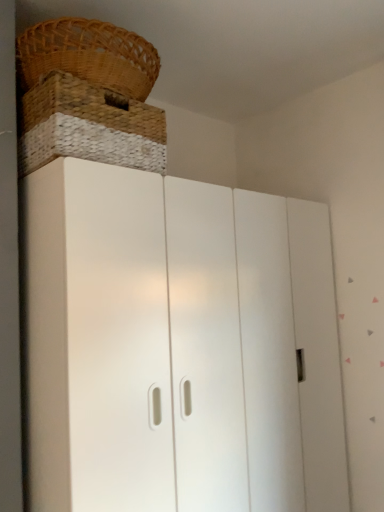
Question: Does white matte cupboard at center come in front of brown woven basket at upper left?

Choices:
 (A) no
 (B) yes

Answer: (B)

Question: Considering the relative sizes of white matte cupboard at center and brown woven basket at upper left in the image provided, is white matte cupboard at center bigger than brown woven basket at upper left?

Choices:
 (A) no
 (B) yes

Answer: (B)

Question: Are white matte cupboard at center and brown woven basket at upper left beside each other?

Choices:
 (A) no
 (B) yes

Answer: (A)

Question: Does white matte cupboard at center have a smaller size compared to brown woven basket at upper left?

Choices:
 (A) yes
 (B) no

Answer: (B)

Question: Is white matte cupboard at center positioned with its back to brown woven basket at upper left?

Choices:
 (A) no
 (B) yes

Answer: (A)

Question: Are white matte cupboard at center and brown woven basket at upper left located far from each other?

Choices:
 (A) no
 (B) yes

Answer: (A)

Question: Can you confirm if brown woven basket at upper left is thinner than white matte cupboard at center?

Choices:
 (A) yes
 (B) no

Answer: (A)

Question: Is brown woven basket at upper left oriented towards white matte cupboard at center?

Choices:
 (A) yes
 (B) no

Answer: (B)

Question: Considering the relative positions of brown woven basket at upper left and white matte cupboard at center in the image provided, is brown woven basket at upper left to the left of white matte cupboard at center from the viewer's perspective?

Choices:
 (A) yes
 (B) no

Answer: (A)

Question: Does brown woven basket at upper left have a greater width compared to white matte cupboard at center?

Choices:
 (A) yes
 (B) no

Answer: (B)

Question: From the image's perspective, is brown woven basket at upper left below white matte cupboard at center?

Choices:
 (A) no
 (B) yes

Answer: (A)

Question: Can you confirm if brown woven basket at upper left is taller than white matte cupboard at center?

Choices:
 (A) yes
 (B) no

Answer: (B)

Question: From the image's perspective, is white matte cupboard at center located above or below brown woven basket at upper left?

Choices:
 (A) above
 (B) below

Answer: (B)